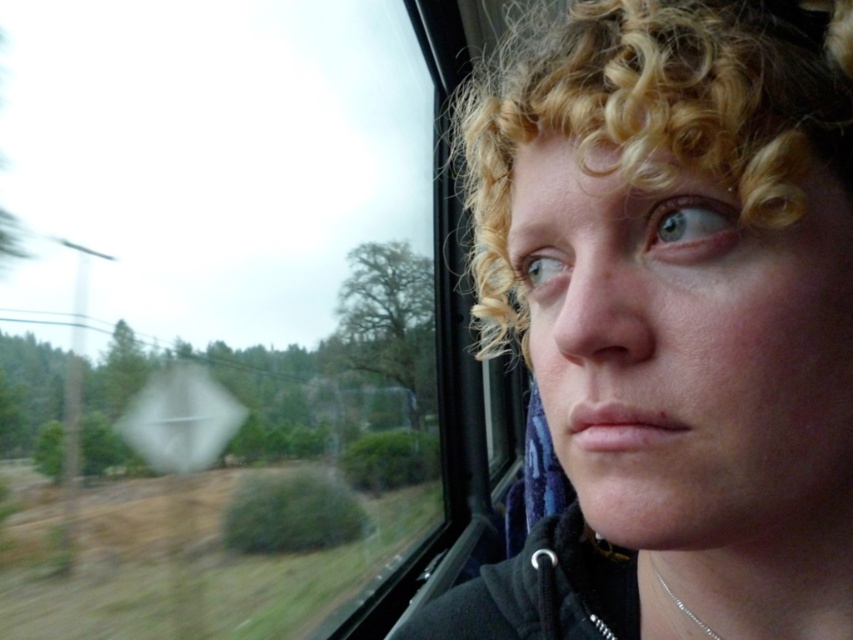
Is transparent glass train window at center to the left of blonde curly hair at upper right from the viewer's perspective?

Correct, you'll find transparent glass train window at center to the left of blonde curly hair at upper right.

From the picture: Can you confirm if transparent glass train window at center is bigger than blonde curly hair at upper right?

Correct, transparent glass train window at center is larger in size than blonde curly hair at upper right.

Identify the location of transparent glass train window at center. The width and height of the screenshot is (853, 640). (238, 320).